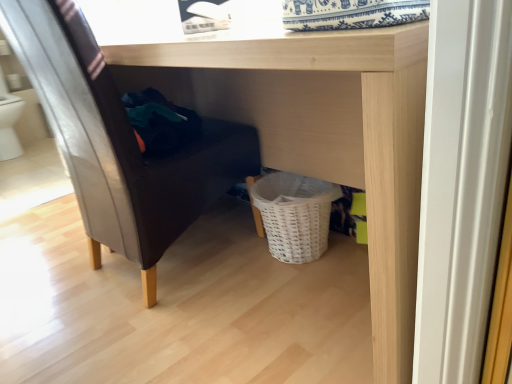
Locate an element on the screen. The width and height of the screenshot is (512, 384). free space that is in between wooden table at center and matte black chair at left is located at coordinates (194, 332).